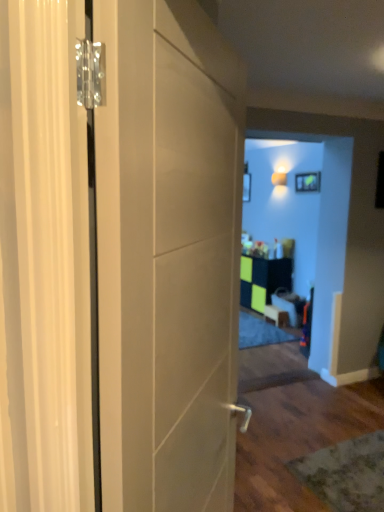
How much space does matte black cabinet at center, which appears as the 2th furniture when viewed from the right, occupy vertically?

It is 8.35 inches.

What is the approximate height of matte white door at left?

The height of matte white door at left is 4.71 feet.

Image resolution: width=384 pixels, height=512 pixels. I want to click on wooden table at center, the 1th furniture viewed from the right, so click(x=289, y=305).

How much space does wooden table at center, which ranks as the second furniture in left-to-right order, occupy vertically?

The height of wooden table at center, which ranks as the second furniture in left-to-right order, is 13.17 inches.

Locate an element on the screen. matte black cabinet at center, which is the first furniture in left-to-right order is located at coordinates (276, 315).

From a real-world perspective, is matte white door at left physically below matte black cabinet at center, which is the first furniture in left-to-right order?

No, from a real-world perspective, matte white door at left is not below matte black cabinet at center, which is the first furniture in left-to-right order.

Is matte black cabinet at center, which appears as the 2th furniture when viewed from the right, at the back of matte white door at left?

No, matte white door at left is not facing the opposite direction of matte black cabinet at center, which appears as the 2th furniture when viewed from the right.

Is matte white door at left in front of matte black cabinet at center, which is the first furniture in left-to-right order?

That is True.

In terms of size, does matte white door at left appear bigger or smaller than matte black cabinet at center, which is the first furniture in left-to-right order?

Clearly, matte white door at left is larger in size than matte black cabinet at center, which is the first furniture in left-to-right order.

From the image's perspective, which one is positioned higher, wooden table at center, the 1th furniture viewed from the right, or matte black cabinet at center, which is the first furniture in left-to-right order?

wooden table at center, the 1th furniture viewed from the right, from the image's perspective.

Considering the sizes of objects wooden table at center, which ranks as the second furniture in left-to-right order, and matte black cabinet at center, which appears as the 2th furniture when viewed from the right, in the image provided, who is bigger, wooden table at center, which ranks as the second furniture in left-to-right order, or matte black cabinet at center, which appears as the 2th furniture when viewed from the right,?

wooden table at center, which ranks as the second furniture in left-to-right order, is bigger.

Consider the image. Is wooden table at center, which ranks as the second furniture in left-to-right order, positioned with its back to matte black cabinet at center, which appears as the 2th furniture when viewed from the right?

No, wooden table at center, which ranks as the second furniture in left-to-right order, is not facing away from matte black cabinet at center, which appears as the 2th furniture when viewed from the right.

Is matte green picture frame at upper center bigger than matte white door at left?

No.

Which point is more forward, (314, 177) or (225, 480)?

Point (225, 480)

Is matte green picture frame at upper center aimed at matte white door at left?

No, matte green picture frame at upper center is not oriented towards matte white door at left.

Consider the image. Considering the sizes of matte black cabinet at center, which appears as the 2th furniture when viewed from the right, and matte white door at left in the image, is matte black cabinet at center, which appears as the 2th furniture when viewed from the right, bigger or smaller than matte white door at left?

Considering their sizes, matte black cabinet at center, which appears as the 2th furniture when viewed from the right, takes up less space than matte white door at left.

Is point (280, 316) farther from camera compared to point (204, 122)?

Yes, point (280, 316) is farther from viewer.

Is matte black cabinet at center, which appears as the 2th furniture when viewed from the right, in front of or behind matte white door at left in the image?

matte black cabinet at center, which appears as the 2th furniture when viewed from the right, is behind matte white door at left.

Is matte black cabinet at center, which is the first furniture in left-to-right order, not close to matte white door at left?

Yes, matte black cabinet at center, which is the first furniture in left-to-right order, is far from matte white door at left.

Can you confirm if matte white door at left is thinner than green matte cabinet at center?

Yes, matte white door at left is thinner than green matte cabinet at center.

Is point (189, 80) closer to camera compared to point (291, 285)?

That is True.

From the picture: Who is taller, matte white door at left or green matte cabinet at center?

matte white door at left.

Which object is positioned more to the right, matte green picture frame at upper center or wooden table at center, which ranks as the second furniture in left-to-right order?

Positioned to the right is matte green picture frame at upper center.

Who is more distant, matte green picture frame at upper center or wooden table at center, which ranks as the second furniture in left-to-right order?

matte green picture frame at upper center.

In the scene shown: Is matte green picture frame at upper center turned away from wooden table at center, the 1th furniture viewed from the right?

No, matte green picture frame at upper center's orientation is not away from wooden table at center, the 1th furniture viewed from the right.

Looking at their sizes, would you say matte green picture frame at upper center is wider or thinner than wooden table at center, which ranks as the second furniture in left-to-right order?

matte green picture frame at upper center is thinner than wooden table at center, which ranks as the second furniture in left-to-right order.

Where is `picture frame in front of the matte black cabinet at center, which is the first furniture in left-to-right order`? picture frame in front of the matte black cabinet at center, which is the first furniture in left-to-right order is located at coordinates (308, 182).

In the scene shown: Is matte green picture frame at upper center at the back of matte black cabinet at center, which appears as the 2th furniture when viewed from the right?

No, matte black cabinet at center, which appears as the 2th furniture when viewed from the right, is not facing away from matte green picture frame at upper center.

Can you confirm if matte black cabinet at center, which appears as the 2th furniture when viewed from the right, is positioned to the right of matte green picture frame at upper center?

In fact, matte black cabinet at center, which appears as the 2th furniture when viewed from the right, is to the left of matte green picture frame at upper center.

Which furniture is the 1st one when counting from the right side of the matte white door at left? Please provide its 2D coordinates.

[(276, 315)]

The width and height of the screenshot is (384, 512). Identify the location of furniture above the matte black cabinet at center, which appears as the 2th furniture when viewed from the right (from a real-world perspective). (289, 305).

Which object lies nearer to the anchor point green matte cabinet at center, matte green picture frame at upper center or matte white door at left?

matte green picture frame at upper center lies closer to green matte cabinet at center than the other object.

Consider the image. When comparing their distances from matte green picture frame at upper center, does matte black cabinet at center, which appears as the 2th furniture when viewed from the right, or matte white door at left seem closer?

matte black cabinet at center, which appears as the 2th furniture when viewed from the right, is positioned closer to the anchor matte green picture frame at upper center.

Based on their spatial positions, is wooden table at center, the 1th furniture viewed from the right, or matte black cabinet at center, which is the first furniture in left-to-right order, closer to green matte cabinet at center?

wooden table at center, the 1th furniture viewed from the right.

Looking at the image, which one is located closer to matte green picture frame at upper center, green matte cabinet at center or matte white door at left?

green matte cabinet at center is closer to matte green picture frame at upper center.

Considering their positions, is matte black cabinet at center, which appears as the 2th furniture when viewed from the right, positioned closer to wooden table at center, which ranks as the second furniture in left-to-right order, than green matte cabinet at center?

Among the two, matte black cabinet at center, which appears as the 2th furniture when viewed from the right, is located nearer to wooden table at center, which ranks as the second furniture in left-to-right order.

Based on their spatial positions, is green matte cabinet at center or wooden table at center, the 1th furniture viewed from the right, further from matte black cabinet at center, which appears as the 2th furniture when viewed from the right?

green matte cabinet at center.

Considering their positions, is matte green picture frame at upper center positioned closer to green matte cabinet at center than matte black cabinet at center, which is the first furniture in left-to-right order?

Among the two, matte black cabinet at center, which is the first furniture in left-to-right order, is located nearer to green matte cabinet at center.

Estimate the real-world distances between objects in this image. Which object is further from wooden table at center, which ranks as the second furniture in left-to-right order, green matte cabinet at center or matte white door at left?

matte white door at left is positioned further to the anchor wooden table at center, which ranks as the second furniture in left-to-right order.

Where is `cabinetry between matte green picture frame at upper center and matte black cabinet at center, which is the first furniture in left-to-right order, vertically`? The image size is (384, 512). cabinetry between matte green picture frame at upper center and matte black cabinet at center, which is the first furniture in left-to-right order, vertically is located at coordinates (263, 280).

This screenshot has height=512, width=384. In order to click on furniture between matte white door at left and matte black cabinet at center, which is the first furniture in left-to-right order, from front to back in this screenshot , I will do `click(289, 305)`.

You are a GUI agent. You are given a task and a screenshot of the screen. Output one action in this format:
    pyautogui.click(x=<x>, y=<y>)
    Task: Click on the cabinetry that lies between matte green picture frame at upper center and wooden table at center, which ranks as the second furniture in left-to-right order, from top to bottom
    The image size is (384, 512).
    Given the screenshot: What is the action you would take?
    pyautogui.click(x=263, y=280)

You are a GUI agent. You are given a task and a screenshot of the screen. Output one action in this format:
    pyautogui.click(x=<x>, y=<y>)
    Task: Click on the furniture between matte white door at left and matte green picture frame at upper center along the z-axis
    
    Given the screenshot: What is the action you would take?
    pyautogui.click(x=289, y=305)